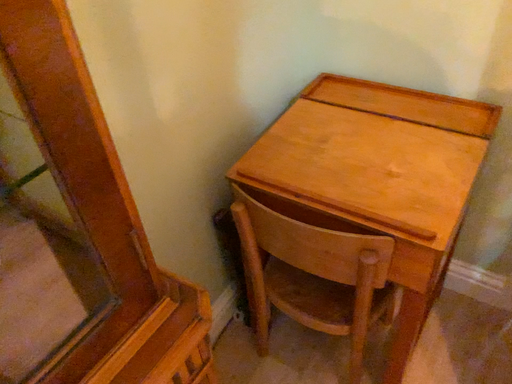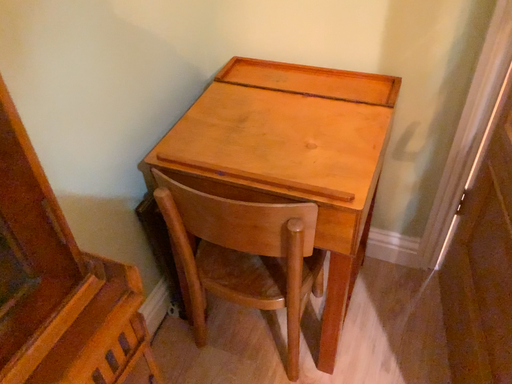
Question: How did the camera likely rotate when shooting the video?

Choices:
 (A) rotated right
 (B) rotated left

Answer: (A)